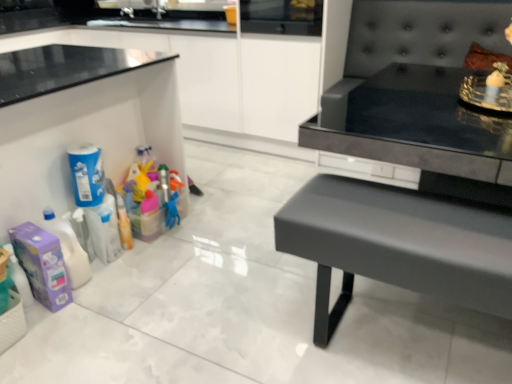
Where is `free space above purple cardboard box at lower left, which is the second cleaning product from top to bottom (from a real-world perspective)`? This screenshot has width=512, height=384. free space above purple cardboard box at lower left, which is the second cleaning product from top to bottom (from a real-world perspective) is located at coordinates (27, 231).